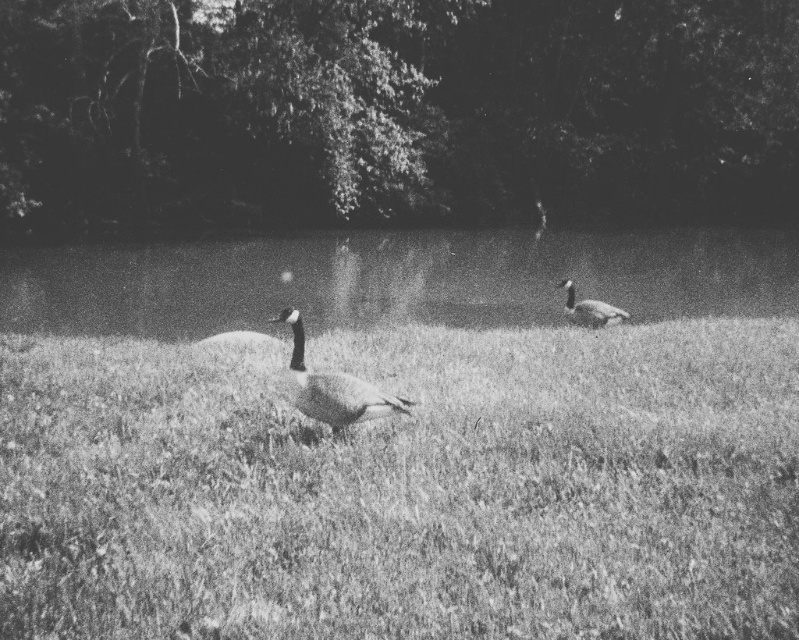
Question: Is smooth water at center above gray feathered duck at center?

Choices:
 (A) yes
 (B) no

Answer: (A)

Question: Is gray feathered duck at center above dark gray feathered duck at center?

Choices:
 (A) yes
 (B) no

Answer: (B)

Question: Which object appears closest to the camera in this image?

Choices:
 (A) grassy field at center
 (B) smooth water at center

Answer: (A)

Question: Which of the following is the closest to the observer?

Choices:
 (A) smooth water at center
 (B) dark gray feathered duck at center

Answer: (B)

Question: Which object appears closest to the camera in this image?

Choices:
 (A) smooth water at center
 (B) dark gray feathered duck at center
 (C) grassy field at center
 (D) gray feathered duck at center

Answer: (C)

Question: Is grassy field at center to the left of smooth water at center from the viewer's perspective?

Choices:
 (A) no
 (B) yes

Answer: (B)